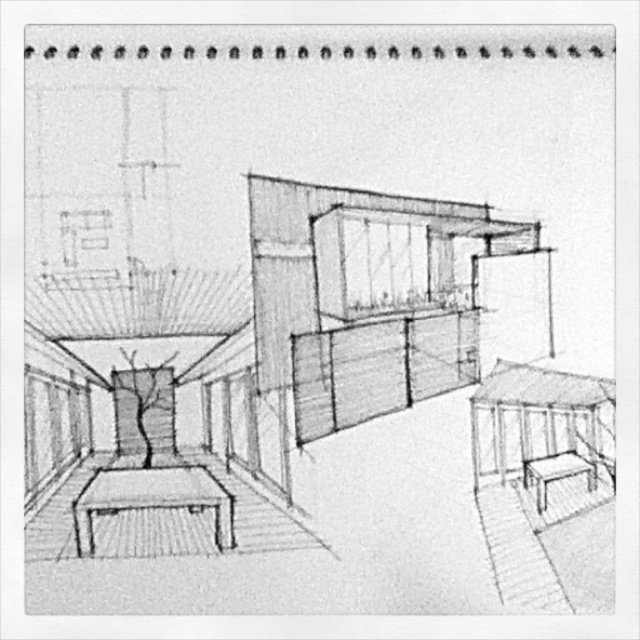
Question: Which point appears closest to the camera in this image?

Choices:
 (A) (147, 499)
 (B) (564, 456)

Answer: (A)

Question: Can you confirm if smooth wooden table at lower left is smaller than matte wood stool at lower right?

Choices:
 (A) yes
 (B) no

Answer: (B)

Question: Does smooth wooden table at lower left have a greater width compared to matte wood stool at lower right?

Choices:
 (A) yes
 (B) no

Answer: (A)

Question: Which point appears farthest from the camera in this image?

Choices:
 (A) (554, 476)
 (B) (198, 490)

Answer: (B)

Question: Among these objects, which one is nearest to the camera?

Choices:
 (A) smooth wooden table at lower left
 (B) matte wood stool at lower right

Answer: (A)

Question: Does smooth wooden table at lower left appear over matte wood stool at lower right?

Choices:
 (A) no
 (B) yes

Answer: (A)